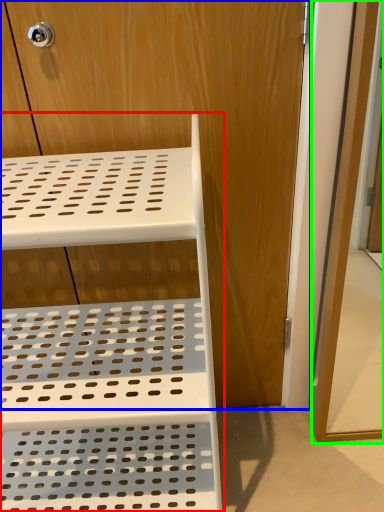
Question: Which object is the closest to the furniture (highlighted by a red box)? Choose among these: dresser (highlighted by a blue box) or screen door (highlighted by a green box).

Choices:
 (A) dresser
 (B) screen door

Answer: (A)